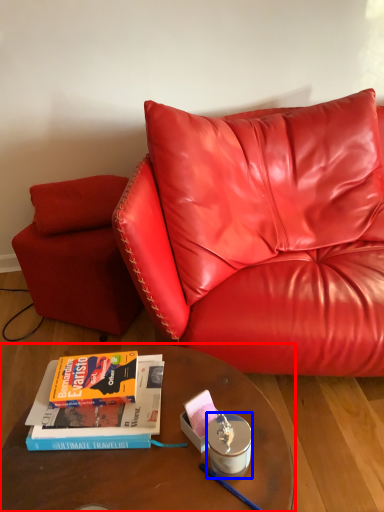
Question: Which point is further to the camera, table (highlighted by a red box) or candle holder (highlighted by a blue box)?

Choices:
 (A) table
 (B) candle holder

Answer: (B)